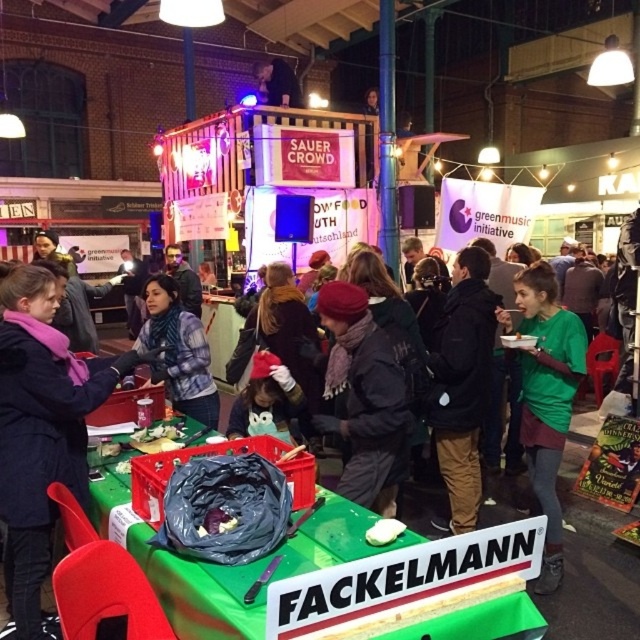
Question: Does plaid fabric jacket at center appear under smooth purple potato at center?

Choices:
 (A) yes
 (B) no

Answer: (B)

Question: Considering the real-world distances, which object is closest to the plaid fabric jacket at center?

Choices:
 (A) dark blue jacket at center
 (B) dark gray knit hat at center

Answer: (A)

Question: Which object appears farthest from the camera in this image?

Choices:
 (A) dark gray knit hat at center
 (B) smooth purple potato at center
 (C) dark blue jacket at center

Answer: (A)

Question: Which object appears farthest from the camera in this image?

Choices:
 (A) smooth purple potato at center
 (B) dark gray knit hat at center
 (C) dark blue jacket at center
 (D) green matte shirt at right

Answer: (D)

Question: Observing the image, what is the correct spatial positioning of green matte shirt at right in reference to smooth purple potato at center?

Choices:
 (A) right
 (B) left

Answer: (A)

Question: Does dark blue jacket at center have a smaller size compared to smooth purple potato at center?

Choices:
 (A) yes
 (B) no

Answer: (B)